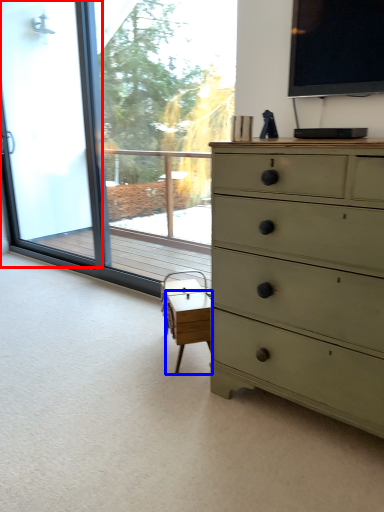
Question: Among these objects, which one is farthest to the camera, screen door (highlighted by a red box) or table (highlighted by a blue box)?

Choices:
 (A) screen door
 (B) table

Answer: (A)